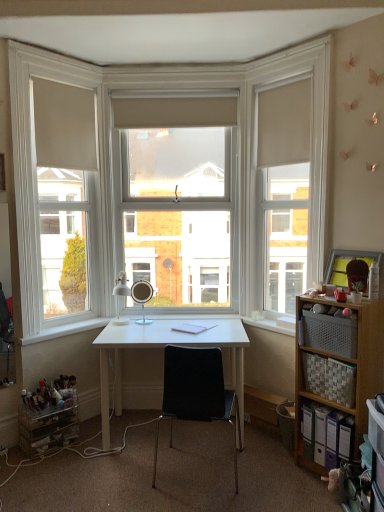
This screenshot has width=384, height=512. Identify the location of vacant area that lies between white glossy desk at center and black plastic chair at center. 148,468.